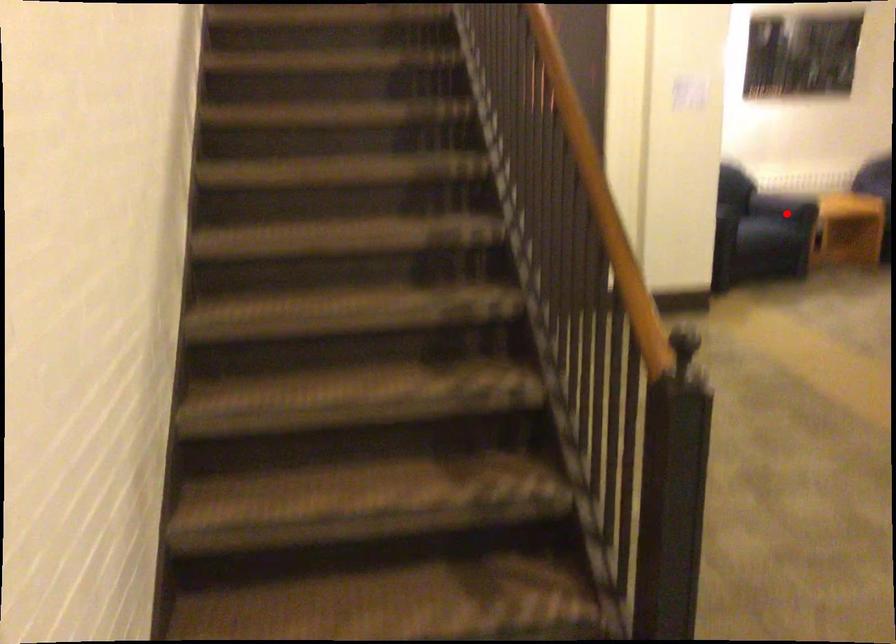
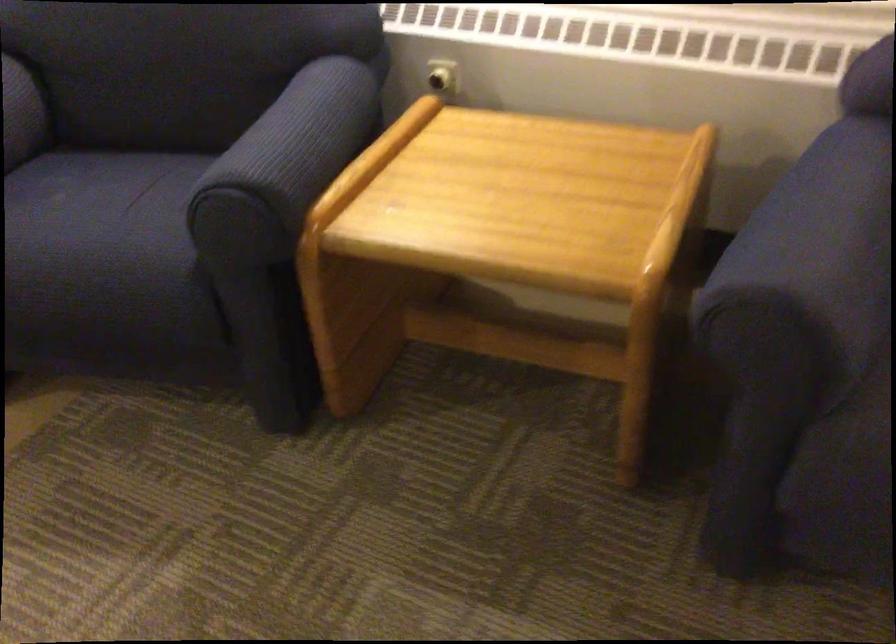
Find the pixel in the second image that matches the highlighted location in the first image.

(99, 232)